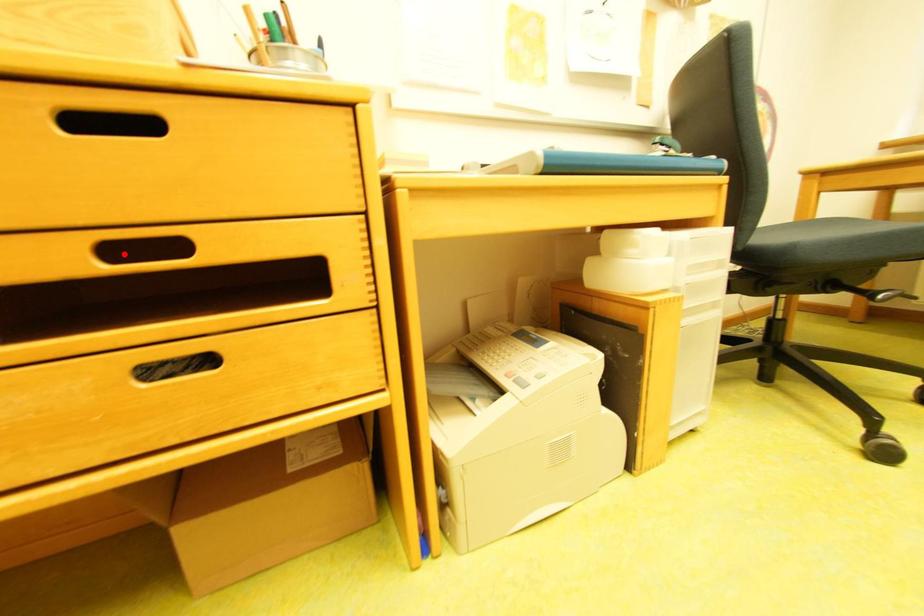
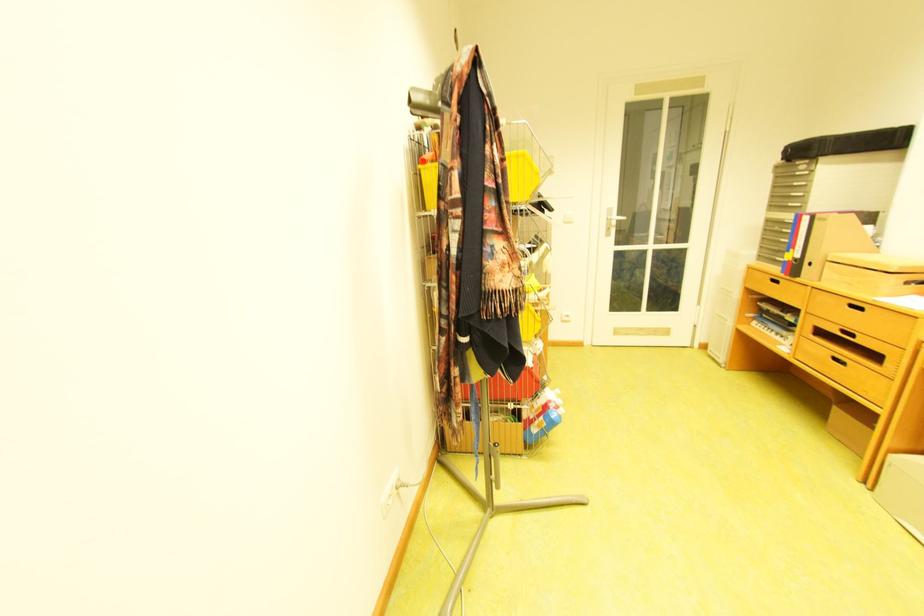
Find the pixel in the second image that matches the highlighted location in the first image.

(855, 333)